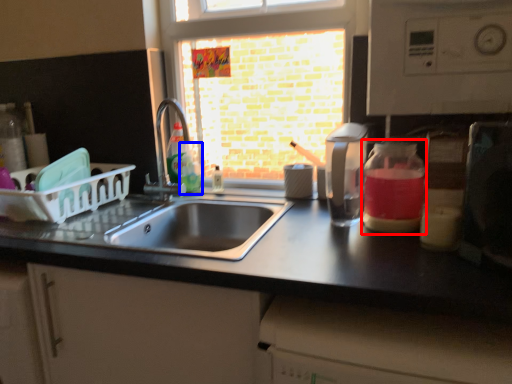
Question: Among these objects, which one is farthest to the camera, glass jar (highlighted by a red box) or bottle (highlighted by a blue box)?

Choices:
 (A) glass jar
 (B) bottle

Answer: (B)